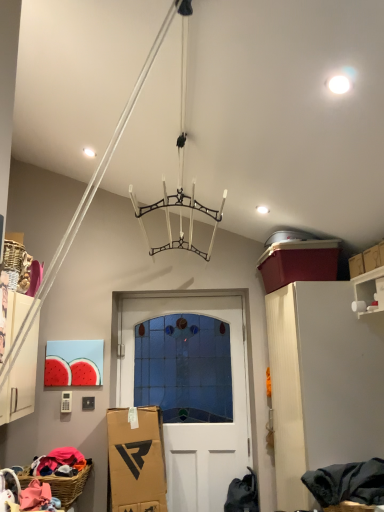
Question: Considering the relative positions of white glossy shelf at upper right and white matte cabinet at right in the image provided, is white glossy shelf at upper right to the left or to the right of white matte cabinet at right?

Choices:
 (A) left
 (B) right

Answer: (B)

Question: Does point (357, 286) appear closer or farther from the camera than point (344, 290)?

Choices:
 (A) closer
 (B) farther

Answer: (A)

Question: Estimate the real-world distances between objects in this image. Which object is closer to the white matte cabinet at right?

Choices:
 (A) dark gray fabric at lower right
 (B) white glossy shelf at upper right
 (C) woven brown basket at lower left
 (D) white glass door at center

Answer: (B)

Question: Which of these objects is positioned farthest from the white glass door at center?

Choices:
 (A) woven brown basket at lower left
 (B) dark gray fabric at lower right
 (C) white glossy shelf at upper right
 (D) white matte cabinet at right

Answer: (C)